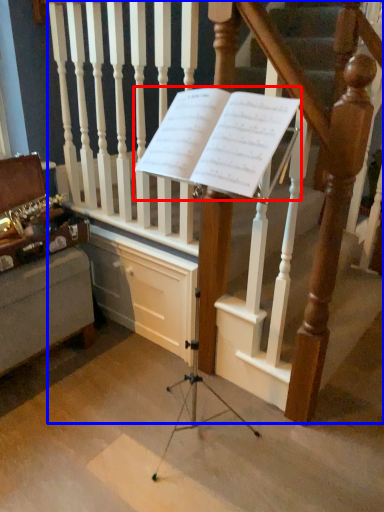
Question: Which point is further to the camera, sheet music (highlighted by a red box) or stairs (highlighted by a blue box)?

Choices:
 (A) sheet music
 (B) stairs

Answer: (B)